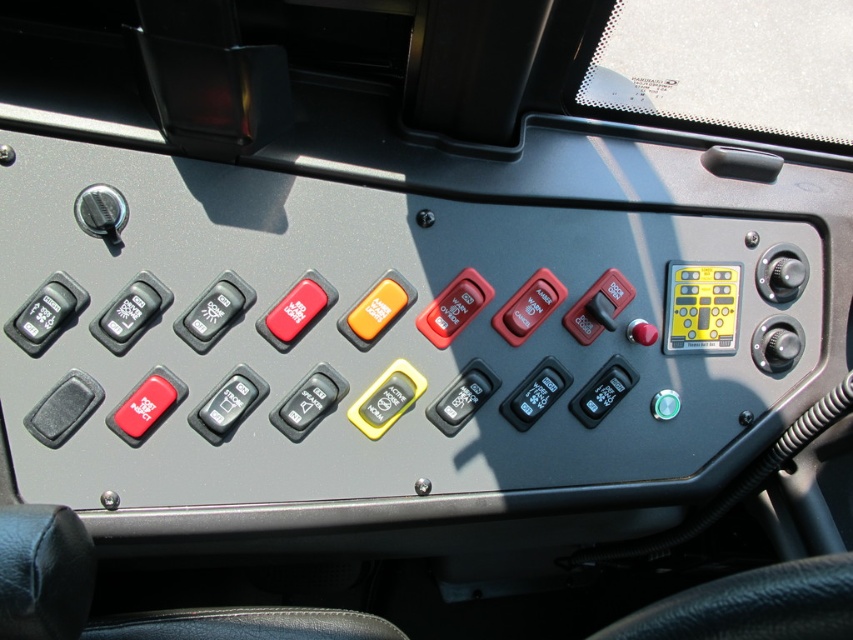
Which is in front, point (705, 330) or point (798, 280)?

Point (705, 330)

Can you confirm if yellow matte keypad at upper right is positioned to the left of satin black knob at right?

Correct, you'll find yellow matte keypad at upper right to the left of satin black knob at right.

Where is `yellow matte keypad at upper right`? The width and height of the screenshot is (853, 640). yellow matte keypad at upper right is located at coordinates (701, 307).

Find the location of a particular element. This screenshot has height=640, width=853. yellow matte keypad at upper right is located at coordinates (701, 307).

Can you confirm if yellow matte keypad at upper right is bigger than metallic knob at upper left?

Indeed, yellow matte keypad at upper right has a larger size compared to metallic knob at upper left.

Which is in front, point (718, 333) or point (99, 227)?

Point (99, 227) is more forward.

Where is `yellow matte keypad at upper right`? yellow matte keypad at upper right is located at coordinates (701, 307).

Between point (782, 269) and point (102, 211), which one is positioned behind?

The point (782, 269) is more distant.

Does point (758, 272) lie behind point (80, 195)?

Yes, point (758, 272) is behind point (80, 195).

Between point (786, 260) and point (103, 209), which one is positioned in front?

Point (103, 209) is in front.

This screenshot has height=640, width=853. I want to click on satin black knob at right, so click(x=780, y=273).